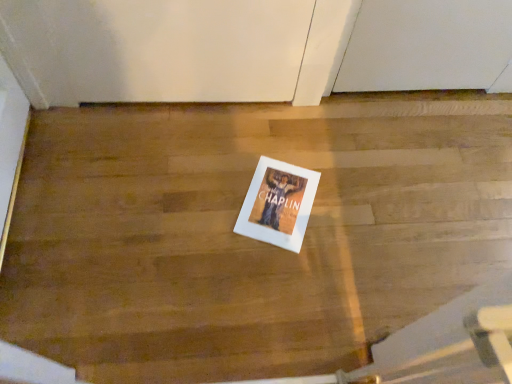
Identify the location of vacant space underneath white paper at center (from a real-world perspective). The image size is (512, 384). (277, 200).